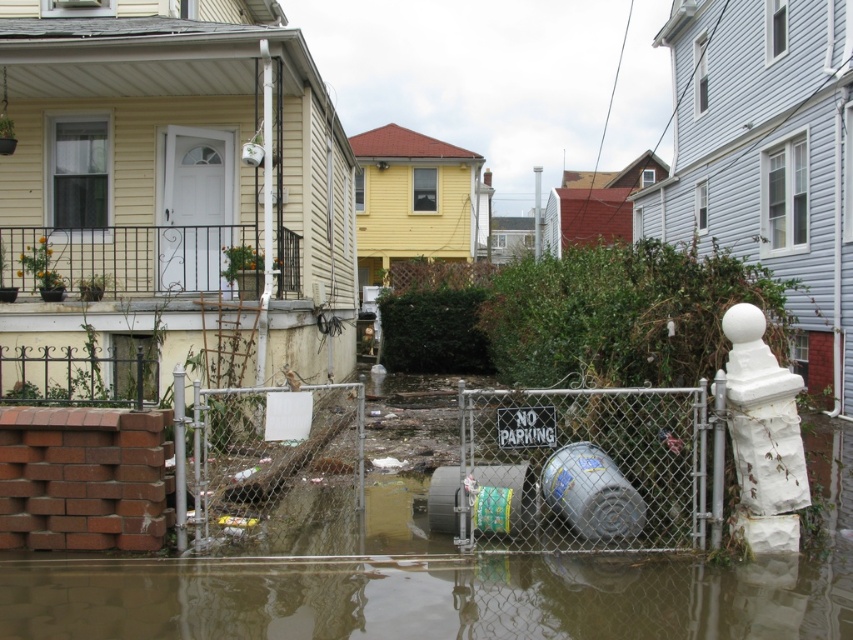
You are a drone operator trying to capture a photo of the flooded area. You need to ensure that both point (207,458) and point (764,596) are in focus. Which point should you focus on to ensure both are sharp?

You should focus on point (207,458) because it is closer to the camera than point (764,596). By focusing on the closer point, the depth of field will extend to include the farther point, ensuring both are in focus.